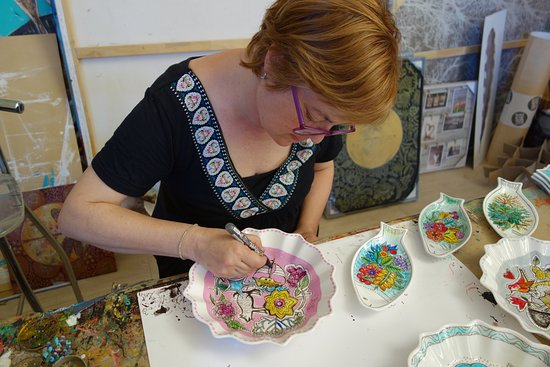
Identify the location of marbled wall. (422, 40).